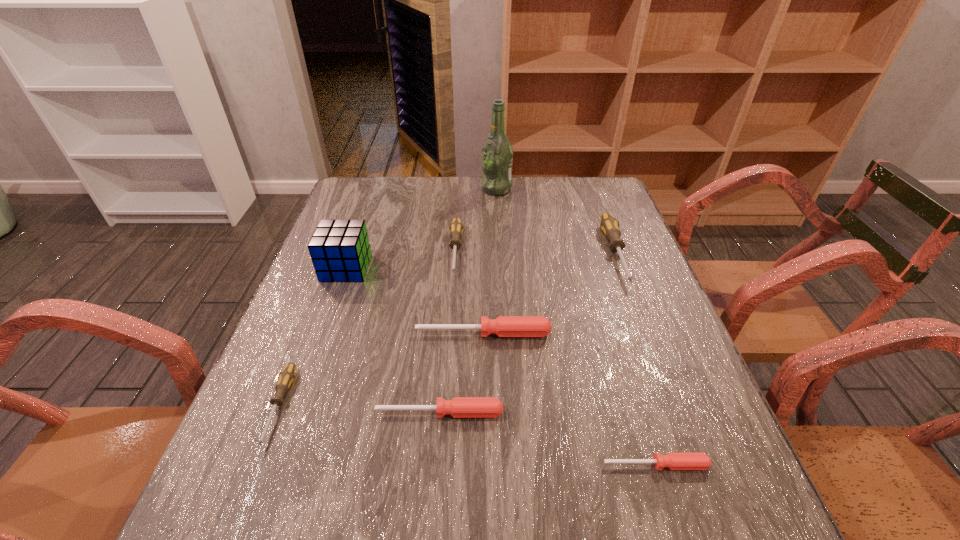
Image resolution: width=960 pixels, height=540 pixels. What are the coordinates of `the smallest gray screwdriver` in the screenshot? It's located at (286, 377).

You are a GUI agent. You are given a task and a screenshot of the screen. Output one action in this format:
    pyautogui.click(x=<x>, y=<y>)
    Task: Click on the leftmost gray screwdriver
    Image resolution: width=960 pixels, height=540 pixels.
    Given the screenshot: What is the action you would take?
    pyautogui.click(x=286, y=377)

The width and height of the screenshot is (960, 540). Find the location of `the shortest screwdriver`. the shortest screwdriver is located at coordinates (674, 461).

Image resolution: width=960 pixels, height=540 pixels. What are the coordinates of `the rightmost red screwdriver` in the screenshot? It's located at (674, 461).

At what (x,y) coordinates should I click in order to perform the action: click on blank space located on the surface of the farthest object. Please return your answer as a coordinate pair (x, y). This screenshot has width=960, height=540. Looking at the image, I should click on (457, 189).

You are a GUI agent. You are given a task and a screenshot of the screen. Output one action in this format:
    pyautogui.click(x=<x>, y=<y>)
    Task: Click on the vacant area located 0.300m on the surface of the farthest object
    The height and width of the screenshot is (540, 960).
    Given the screenshot: What is the action you would take?
    pyautogui.click(x=391, y=189)

Where is `vacant space located 0.120m on the surface of the farthest object`? This screenshot has width=960, height=540. vacant space located 0.120m on the surface of the farthest object is located at coordinates (445, 189).

Locate an element on the screen. The height and width of the screenshot is (540, 960). vacant position located on the front of the cube is located at coordinates (297, 408).

In order to click on vacant space situated 0.310m at the tip of the rightmost gray screwdriver in this screenshot , I will do `click(670, 399)`.

Identify the location of free space located at the tip of the second biggest gray screwdriver. [444, 416].